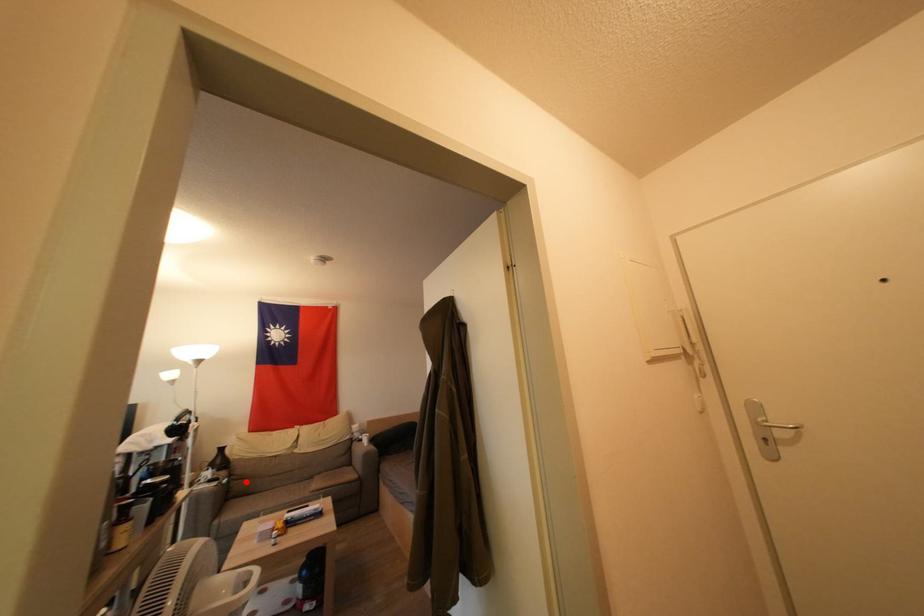
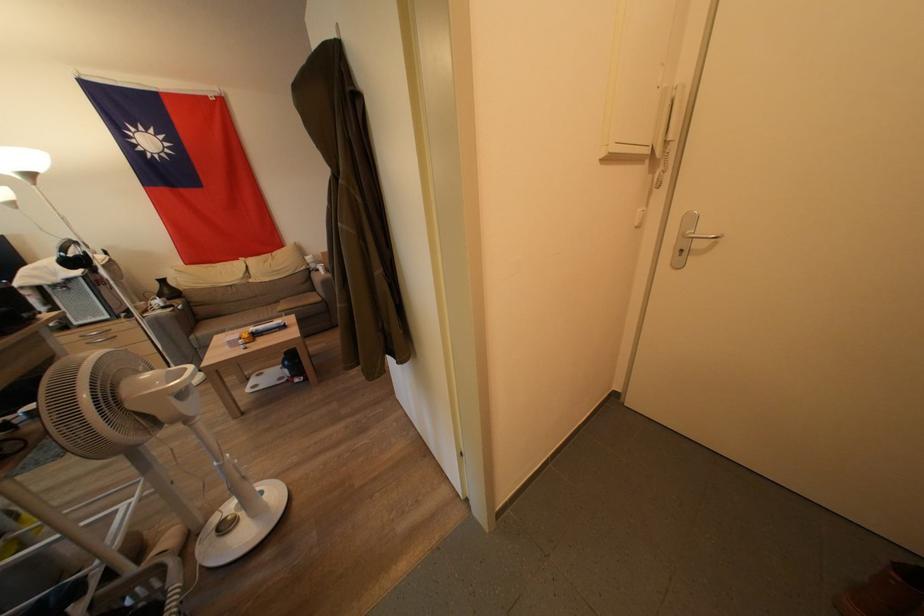
Question: I am providing you with two images of the same scene from different viewpoints. In image1, a red point is highlighted. Considering the same 3D point in image2, which of the following is correct?

Choices:
 (A) It is closer
 (B) It is farther

Answer: (A)